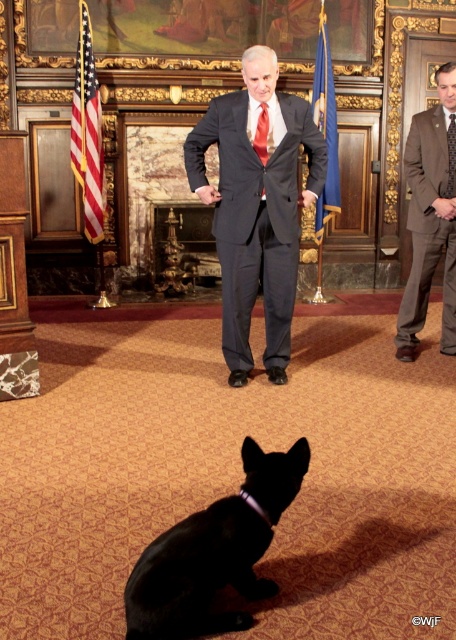
Question: In this image, where is american flag at left located relative to red silk tie at center?

Choices:
 (A) right
 (B) left

Answer: (B)

Question: Which of the following is the closest to the observer?

Choices:
 (A) black textured tie at right
 (B) matte gray suit at center

Answer: (B)

Question: Does matte gray suit at center have a smaller size compared to brown textured suit at right?

Choices:
 (A) no
 (B) yes

Answer: (A)

Question: Among these objects, which one is nearest to the camera?

Choices:
 (A) red silk tie at center
 (B) brown textured suit at right
 (C) blue fabric flag at center
 (D) american flag at left

Answer: (A)

Question: Which point is closer to the camera?

Choices:
 (A) (124, 596)
 (B) (288, 145)
 (C) (450, 212)
 (D) (73, 160)

Answer: (A)

Question: Is blue fabric flag at center further to the viewer compared to red silk tie at center?

Choices:
 (A) yes
 (B) no

Answer: (A)